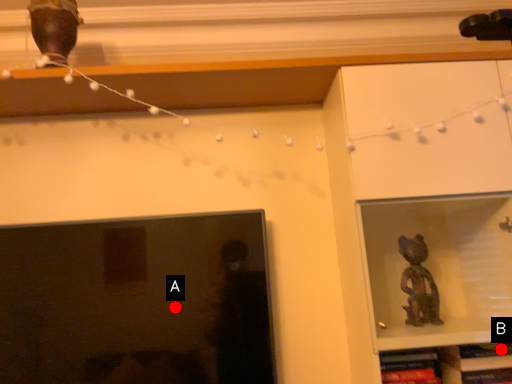
Question: Two points are circled on the image, labeled by A and B beside each circle. Which point is closer to the camera taking this photo?

Choices:
 (A) A is closer
 (B) B is closer

Answer: (B)